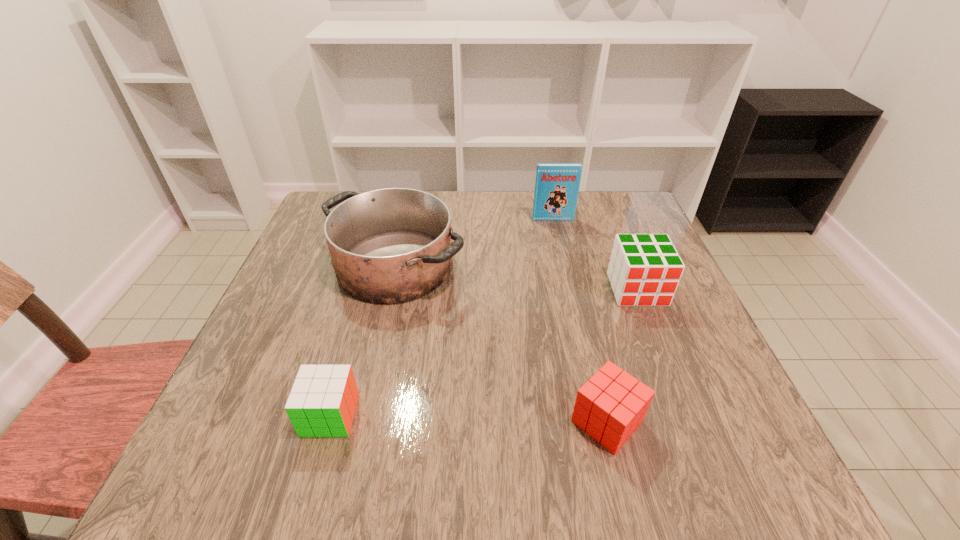
In the image, there is a desktop. Where is `vacant space at the near edge`? The image size is (960, 540). vacant space at the near edge is located at coordinates (337, 440).

Where is `vacant region at the left edge of the desktop`? The height and width of the screenshot is (540, 960). vacant region at the left edge of the desktop is located at coordinates [314, 339].

The height and width of the screenshot is (540, 960). In the image, there is a desktop. Find the location of `vacant region at the right edge`. vacant region at the right edge is located at coordinates (684, 412).

In the image, there is a desktop. At what (x,y) coordinates should I click in order to perform the action: click on blank space at the far left corner. Please return your answer as a coordinate pair (x, y). The width and height of the screenshot is (960, 540). Looking at the image, I should click on (309, 226).

In the image, there is a desktop. Identify the location of free region at the far right corner. The height and width of the screenshot is (540, 960). click(x=611, y=204).

The width and height of the screenshot is (960, 540). In order to click on free space between the second cube from right to left and the book in this screenshot , I will do pos(580,320).

Identify the location of free point between the tallest object and the second cube from left to right. (580, 320).

This screenshot has height=540, width=960. I want to click on vacant space that is in between the rightmost cube and the second cube from right to left, so click(622, 355).

Locate an element on the screen. This screenshot has width=960, height=540. vacant space that's between the second cube from right to left and the leftmost cube is located at coordinates (468, 418).

The width and height of the screenshot is (960, 540). Find the location of `free space between the second cube from left to right and the farthest object`. free space between the second cube from left to right and the farthest object is located at coordinates (580, 320).